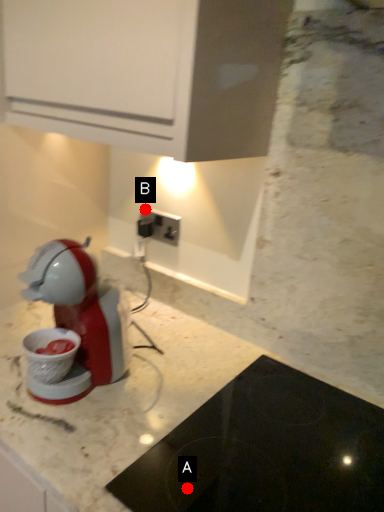
Question: Two points are circled on the image, labeled by A and B beside each circle. Which point is further to the camera?

Choices:
 (A) A is further
 (B) B is further

Answer: (B)